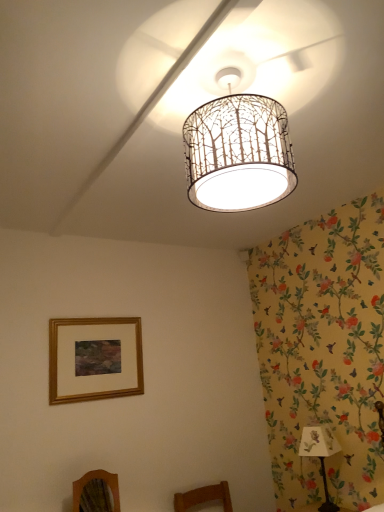
Question: Considering the positions of gold wooden picture frame at lower left and white paper shade at lower right in the image, is gold wooden picture frame at lower left wider or thinner than white paper shade at lower right?

Choices:
 (A) thin
 (B) wide

Answer: (A)

Question: Is point (127, 355) positioned closer to the camera than point (322, 464)?

Choices:
 (A) farther
 (B) closer

Answer: (B)

Question: Which object is the closest to the white paper lampshade at center?

Choices:
 (A) gold wooden picture frame at lower left
 (B) wooden mirror at lower left
 (C) white paper shade at lower right

Answer: (A)

Question: Estimate the real-world distances between objects in this image. Which object is farther from the white paper lampshade at center?

Choices:
 (A) white paper shade at lower right
 (B) wooden mirror at lower left
 (C) gold wooden picture frame at lower left

Answer: (A)